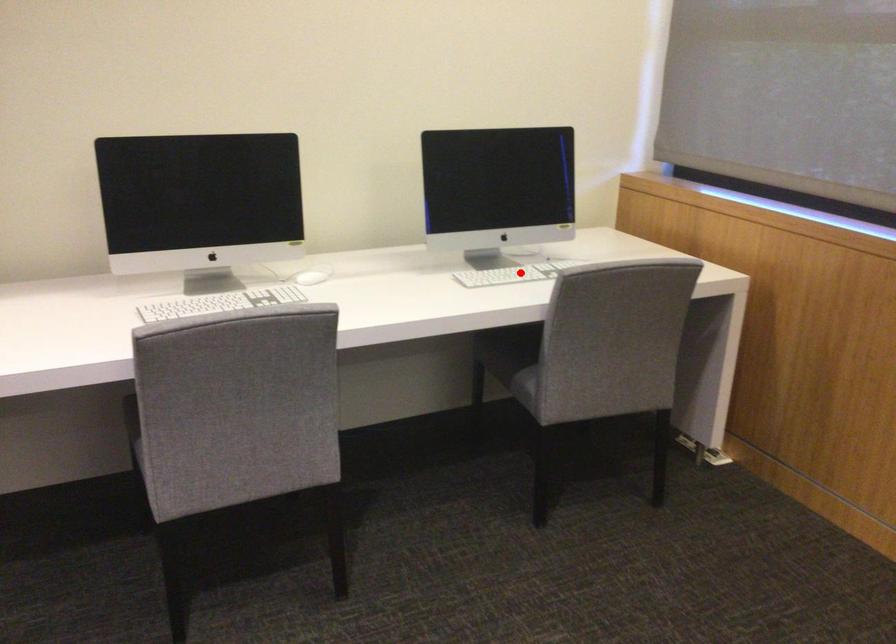
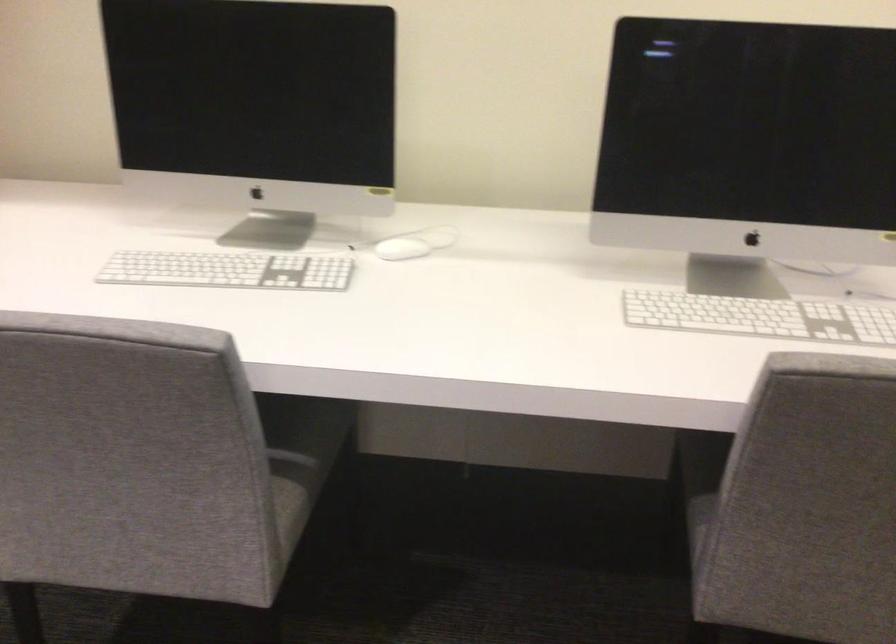
Question: I am providing you with two images of the same scene from different viewpoints. Given a red point in image1, look at the same physical point in image2. Is it:

Choices:
 (A) Closer to the viewpoint
 (B) Farther from the viewpoint

Answer: (A)